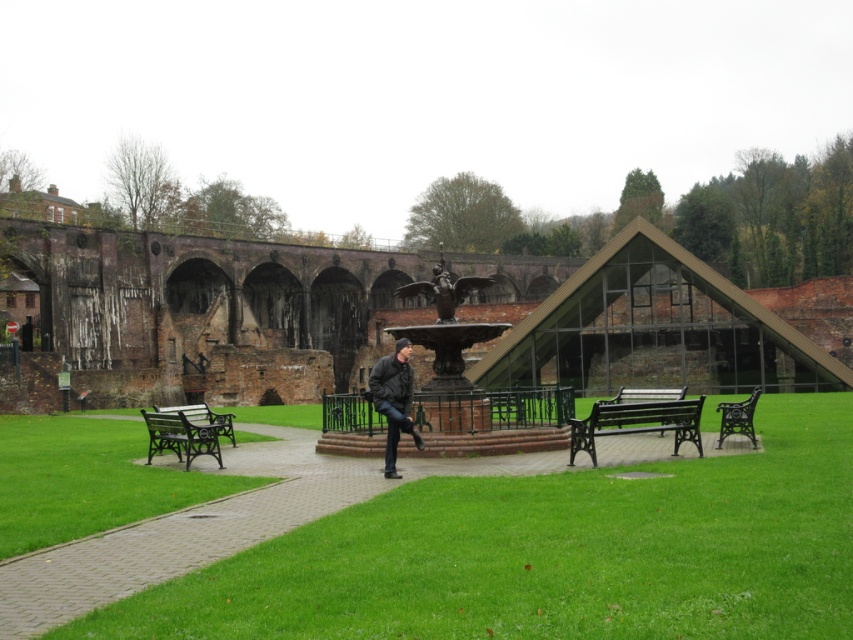
From the picture: Which of these two, green wrought iron bench at center or green wrought iron bench at lower left, stands taller?

green wrought iron bench at lower left

Is green wrought iron bench at center further to camera compared to green wrought iron bench at lower left?

No, it is in front of green wrought iron bench at lower left.

Describe the element at coordinates (636, 422) in the screenshot. I see `green wrought iron bench at center` at that location.

Identify the location of green wrought iron bench at center. (636, 422).

Is green grass at center shorter than black wrought iron bench at lower right?

Correct, green grass at center is not as tall as black wrought iron bench at lower right.

Which is above, green grass at center or black wrought iron bench at lower right?

Positioned higher is black wrought iron bench at lower right.

Is point (723, 627) in front of point (740, 426)?

Yes, point (723, 627) is closer to viewer.

Where is `green grass at center`? This screenshot has width=853, height=640. green grass at center is located at coordinates (552, 554).

Who is more distant from viewer, (625, 417) or (404, 365)?

The point (404, 365) is more distant.

Which is in front, point (677, 444) or point (397, 426)?

Point (397, 426) is more forward.

Does point (631, 429) come behind point (386, 358)?

No.

Image resolution: width=853 pixels, height=640 pixels. What are the coordinates of `green wrought iron bench at center` in the screenshot? It's located at (636, 422).